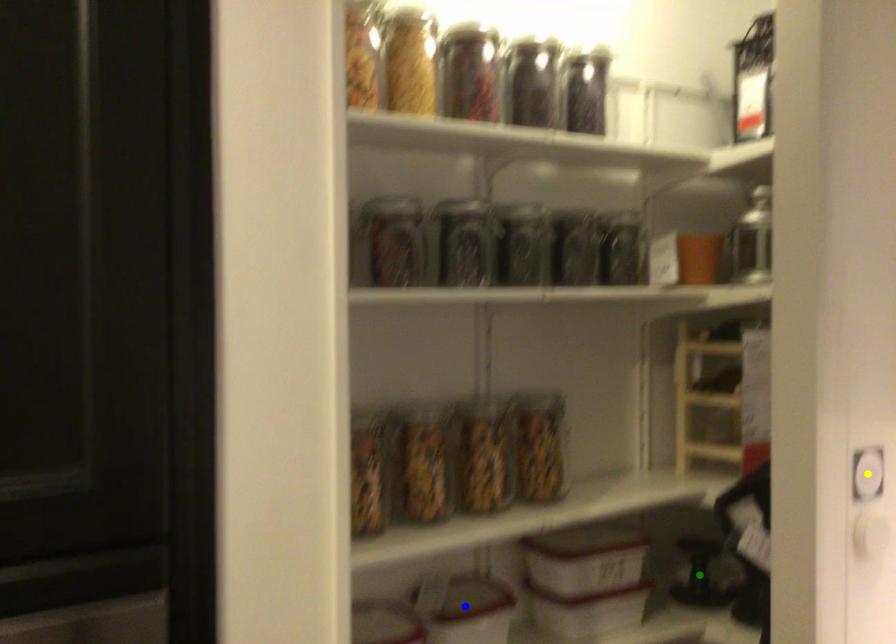
Order these from nearest to farthest:
- yellow point
- green point
- blue point

green point < blue point < yellow point